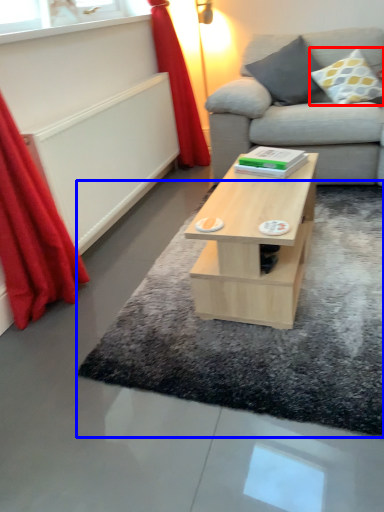
Question: Which of the following is the farthest to the observer, pillow (highlighted by a red box) or mat (highlighted by a blue box)?

Choices:
 (A) pillow
 (B) mat

Answer: (A)